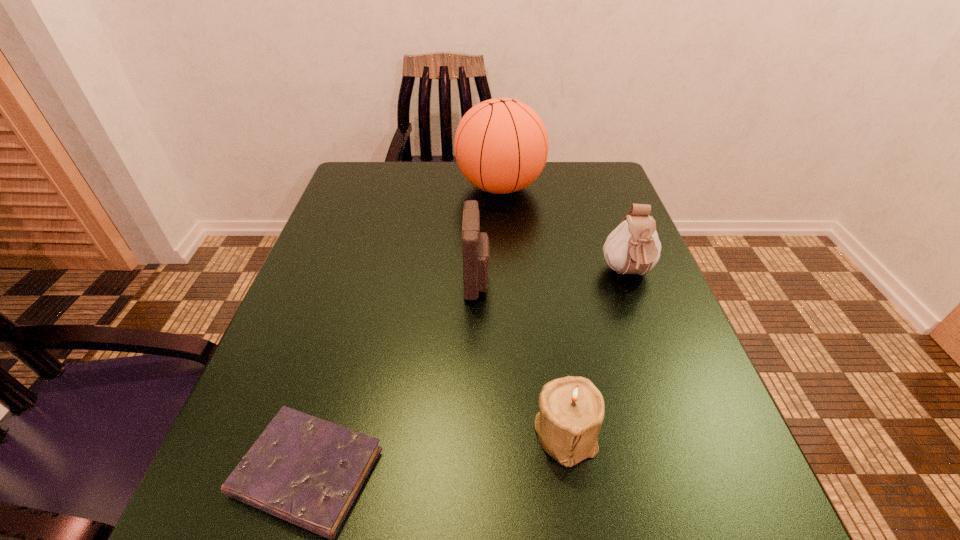
Identify the location of free space that is in between the left pouch and the farthest object. This screenshot has width=960, height=540. (489, 234).

Select which object appears as the closest to the leftmost object. Please provide its 2D coordinates. Your answer should be formatted as a tuple, i.e. [(x, y)], where the tuple contains the x and y coordinates of a point satisfying the conditions above.

[(572, 409)]

Identify which object is the third closest to the left pouch. Please provide its 2D coordinates. Your answer should be formatted as a tuple, i.e. [(x, y)], where the tuple contains the x and y coordinates of a point satisfying the conditions above.

[(633, 247)]

This screenshot has height=540, width=960. What are the coordinates of `free point that satisfies the following two spatial constraints: 1. on the front side of the candle_holder; 2. on the right side of the farthest object` in the screenshot? It's located at (516, 433).

I want to click on free space that satisfies the following two spatial constraints: 1. on the front-facing side of the rightmost object; 2. with an open flap on the left pouch, so click(x=631, y=280).